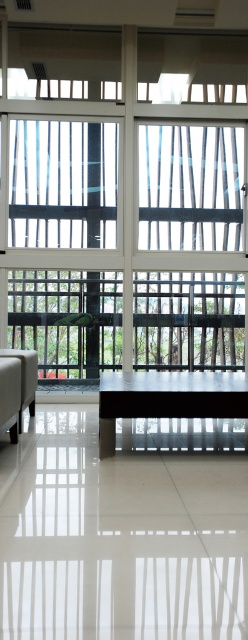
You are standing in the room and want to look outside through both the transparent glass window at center and the transparent glass window at upper left. Which window is located to the right of the other?

The transparent glass window at center is positioned on the right side of the transparent glass window at upper left, so the transparent glass window at center is to the right of the transparent glass window at upper left.

You are standing in the room and want to look outside through the transparent glass window at center. According to the coordinates provided, where should you position yourself to have the best view of the outdoor area?

The transparent glass window at center is located at coordinates [125,196], so positioning yourself directly in front of this point would provide the best view of the outdoor area.

You are standing in the room and want to look through the transparent glass window at center and the transparent glass window at upper left. Which window is closer to you?

The transparent glass window at center is closer to you because it is in front of the transparent glass window at upper left.